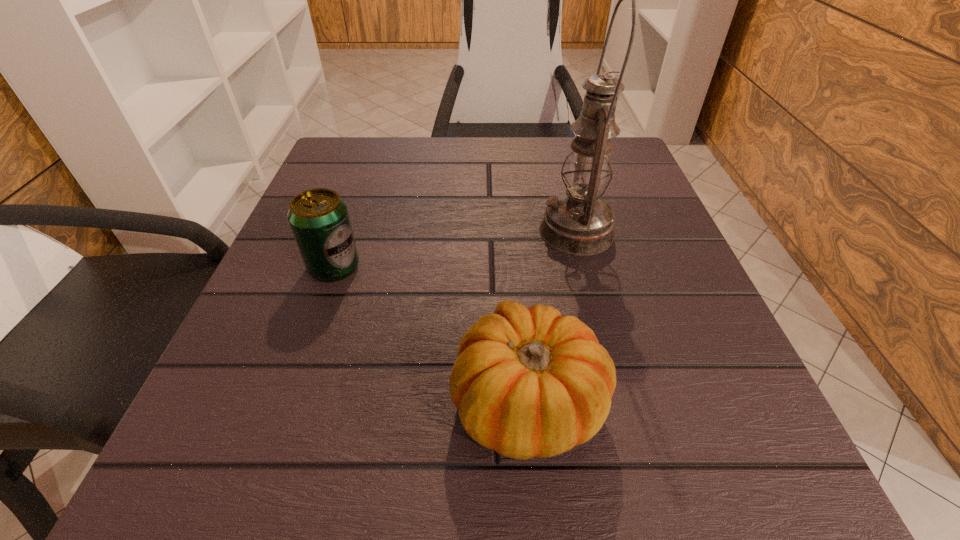
You are a GUI agent. You are given a task and a screenshot of the screen. Output one action in this format:
    pyautogui.click(x=<x>, y=<y>)
    Task: Click on the vacant region between the oil lamp and the leftmost object
    The width and height of the screenshot is (960, 540).
    Given the screenshot: What is the action you would take?
    pos(455,249)

The image size is (960, 540). I want to click on free spot between the leftmost object and the gourd, so click(x=431, y=334).

What are the coordinates of `vacant space that's between the oil lamp and the leftmost object` in the screenshot? It's located at (455, 249).

Locate an element on the screen. empty space between the tallest object and the beer can is located at coordinates (455, 249).

Where is `object that stands as the closest to the beer can`? This screenshot has width=960, height=540. object that stands as the closest to the beer can is located at coordinates (527, 382).

Where is `object that ranks as the second closest to the tallest object`? The image size is (960, 540). object that ranks as the second closest to the tallest object is located at coordinates (319, 219).

You are a GUI agent. You are given a task and a screenshot of the screen. Output one action in this format:
    pyautogui.click(x=<x>, y=<y>)
    Task: Click on the free space that satisfies the following two spatial constraints: 1. on the back side of the tallest object; 2. on the right side of the gourd
    This screenshot has height=540, width=960.
    Given the screenshot: What is the action you would take?
    pyautogui.click(x=514, y=232)

Locate an element on the screen. vacant position in the image that satisfies the following two spatial constraints: 1. on the front side of the nearest object; 2. on the right side of the beer can is located at coordinates (287, 402).